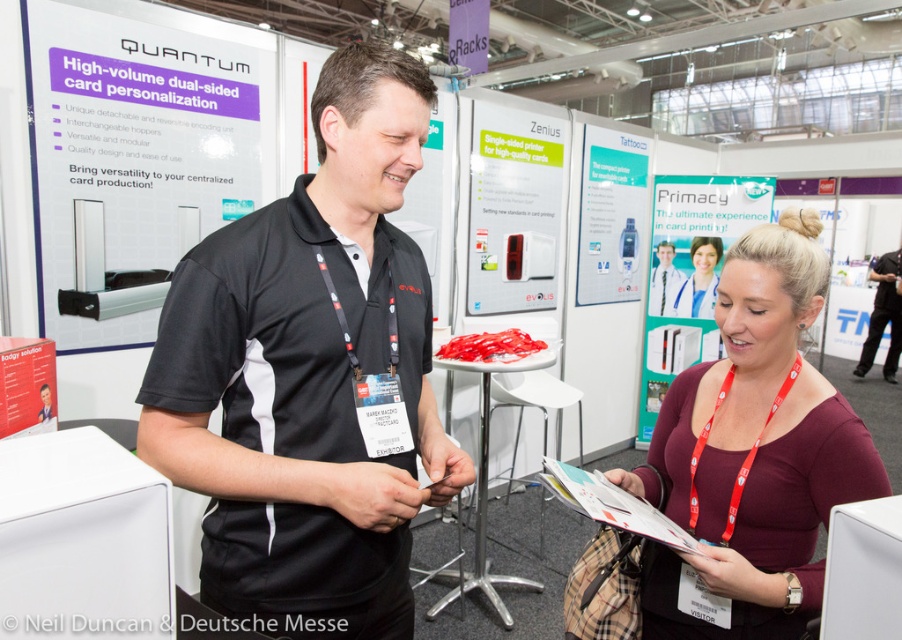
Based on the photo, you are standing in the Deutsche Messe exhibition hall and see the white plastic printer at upper center and the red paper poster at lower left. Which object is closer to you?

The white plastic printer at upper center is closer to you because it is further to the viewer than the red paper poster at lower left.

In the scene shown: What is located at the coordinates point (753, 451) in the image?

The point (753, 451) corresponds to the maroon jersey at center.

You are standing at the camera position in the image. There is a white plastic printer at upper center. Can you reach the printer within 3 steps without moving your legs?

The distance between the white plastic printer at upper center and the camera is 12.95 feet. Since 3 steps typically cover about 9 feet, you cannot reach the printer within 3 steps without moving your legs.